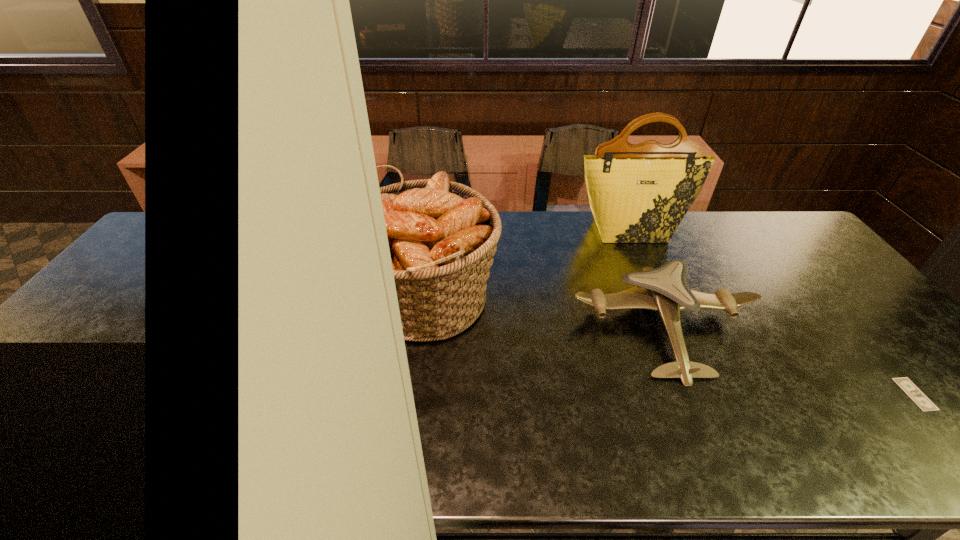
I want to click on vacant space located 0.070m on the front of the rightmost object, so (955, 441).

This screenshot has height=540, width=960. What are the coordinates of `object positioned at the far edge` in the screenshot? It's located at (639, 193).

Image resolution: width=960 pixels, height=540 pixels. Identify the location of object that is positioned at the right edge. 916,395.

The height and width of the screenshot is (540, 960). I want to click on vacant space at the far edge of the desktop, so click(x=727, y=222).

The image size is (960, 540). I want to click on free space at the near edge, so click(x=173, y=448).

The image size is (960, 540). I want to click on free space at the left edge of the desktop, so click(74, 384).

Locate an element on the screen. This screenshot has height=540, width=960. free space at the right edge of the desktop is located at coordinates (911, 376).

Find the location of `free space at the far left corner of the desktop`. free space at the far left corner of the desktop is located at coordinates (188, 241).

Find the location of a particular element. The width and height of the screenshot is (960, 540). free point at the far right corner is located at coordinates (783, 231).

Image resolution: width=960 pixels, height=540 pixels. I want to click on vacant region between the drone and the rightmost object, so click(x=789, y=360).